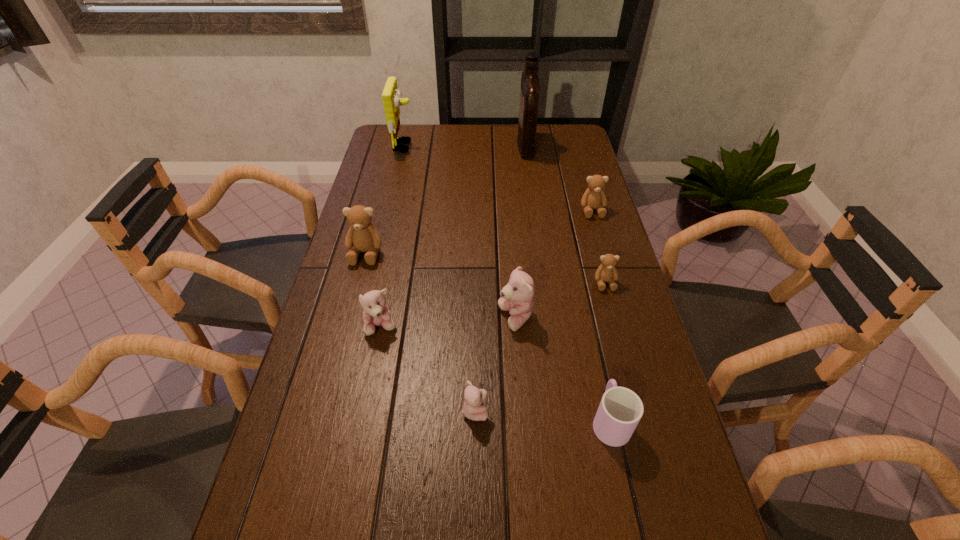
You are a GUI agent. You are given a task and a screenshot of the screen. Output one action in this format:
    pyautogui.click(x=<x>, y=<y>)
    Task: Click on the blank space located at the face of the fourth teddy bear from left to right
    Image resolution: width=960 pixels, height=540 pixels.
    Given the screenshot: What is the action you would take?
    pyautogui.click(x=387, y=318)

Find the location of a particular element. The image size is (960, 540). vacant space located at the face of the fourth teddy bear from left to right is located at coordinates (375, 318).

The width and height of the screenshot is (960, 540). I want to click on vacant space located 0.180m on the face of the second farthest teddy bear, so click(x=349, y=316).

Find the location of a particular element. The image size is (960, 540). free space located on the face of the second biggest brown teddy bear is located at coordinates (599, 234).

In order to click on vacant region located 0.380m at the face of the second smallest pink teddy bear in this screenshot , I will do `click(347, 508)`.

You are a GUI agent. You are given a task and a screenshot of the screen. Output one action in this format:
    pyautogui.click(x=<x>, y=<y>)
    Task: Click on the vacant region located 0.350m with the handle on the side of the cup
    
    Given the screenshot: What is the action you would take?
    pyautogui.click(x=580, y=280)

Find the location of a particular element. Image resolution: width=960 pixels, height=540 pixels. free region located 0.370m with the handle on the side of the cup is located at coordinates (579, 275).

This screenshot has width=960, height=540. I want to click on free space located with the handle on the side of the cup, so click(x=588, y=320).

The image size is (960, 540). In order to click on free region located 0.090m on the face of the fourth nearest teddy bear in this screenshot , I will do `click(614, 318)`.

The image size is (960, 540). I want to click on vacant space situated 0.340m at the face of the sixth object from right to left, so click(x=647, y=410).